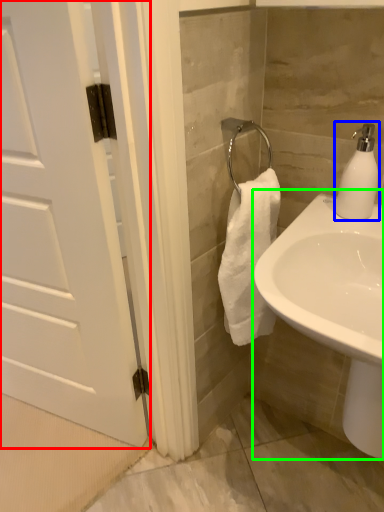
Question: Which is farther away from door (highlighted by a red box)? soap dispenser (highlighted by a blue box) or sink (highlighted by a green box)?

Choices:
 (A) soap dispenser
 (B) sink

Answer: (A)